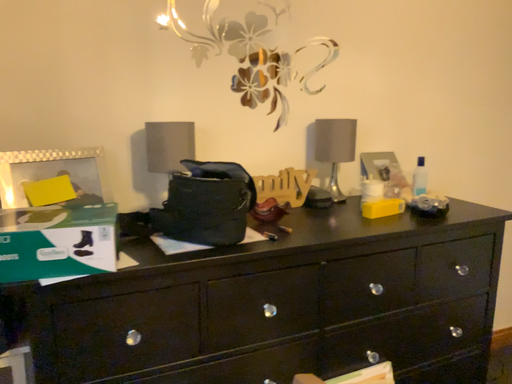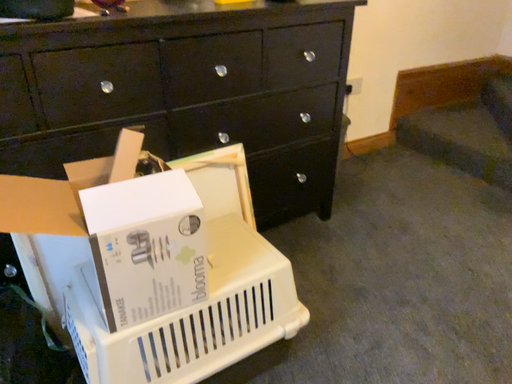
Question: How did the camera likely rotate when shooting the video?

Choices:
 (A) rotated upward
 (B) rotated downward

Answer: (B)